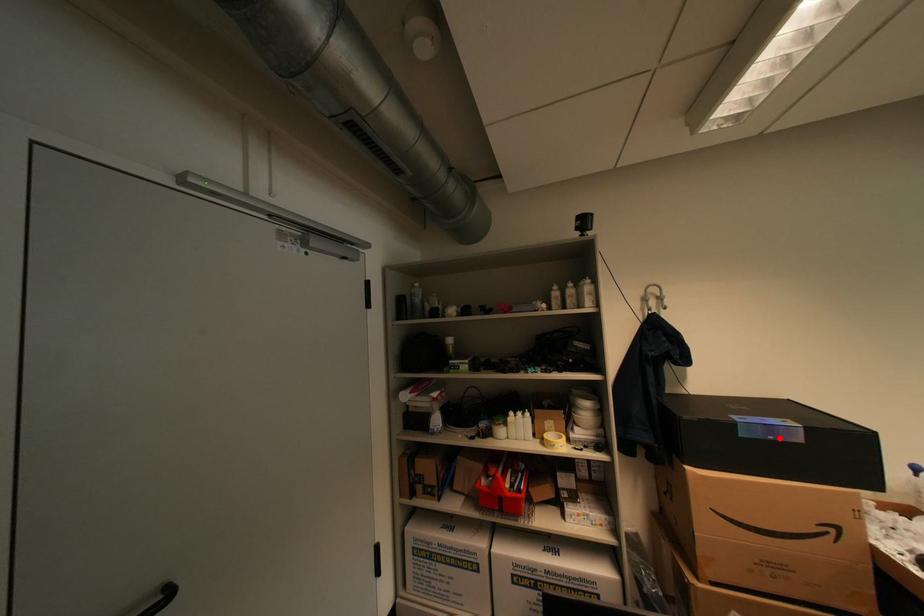
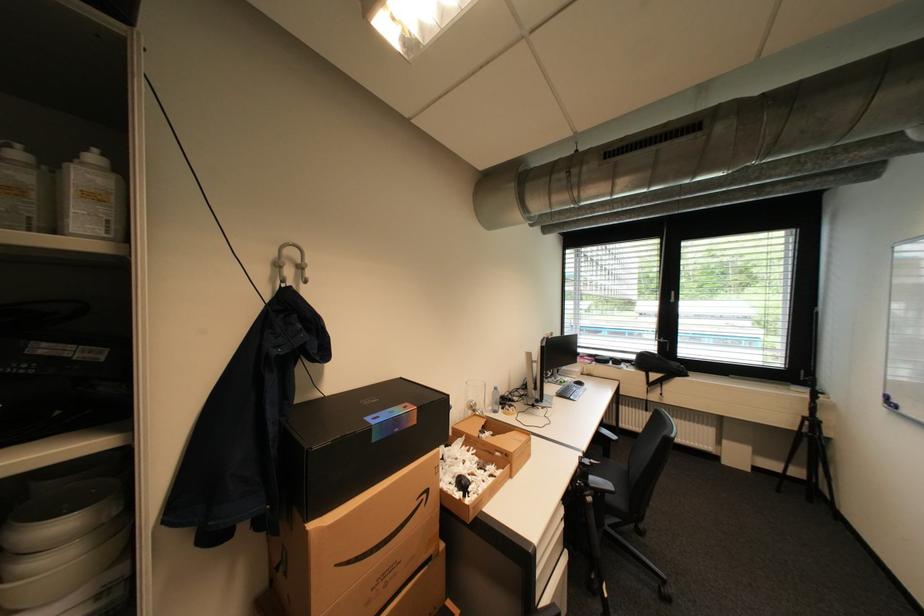
Where in the second image is the point corresponding to the highlighted location from the first image?

(405, 431)